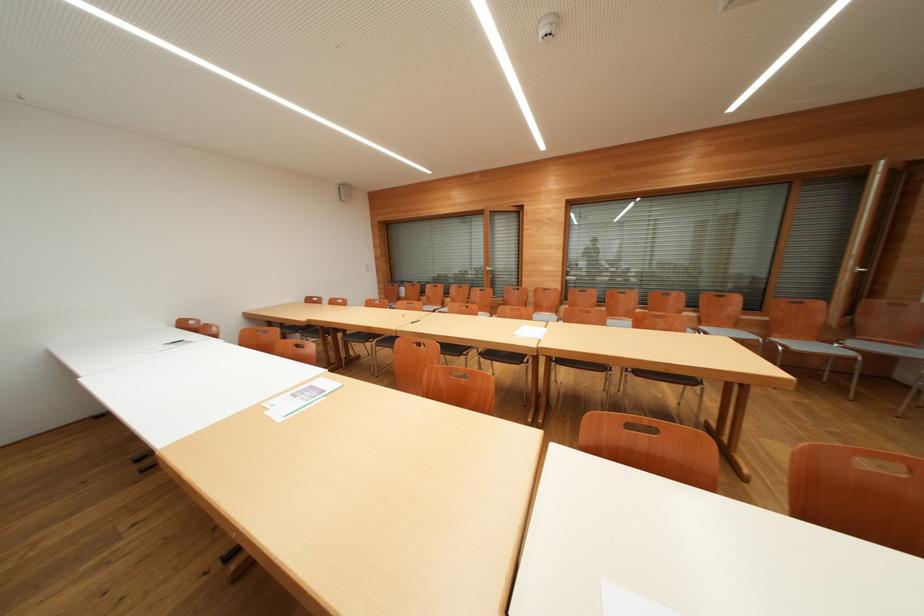
The height and width of the screenshot is (616, 924). What do you see at coordinates (860, 270) in the screenshot? I see `the silver window handle` at bounding box center [860, 270].